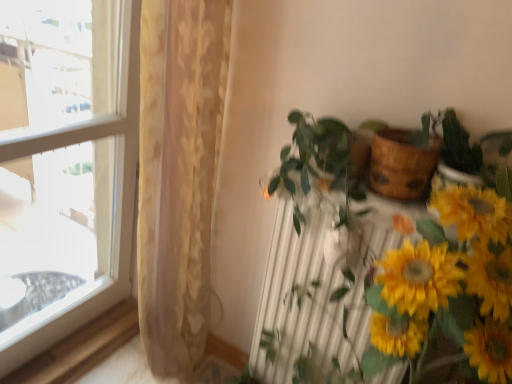
Question: Can you confirm if wooden at upper right is taller than green glossy plant at center?

Choices:
 (A) yes
 (B) no

Answer: (B)

Question: Is wooden at upper right oriented towards green glossy plant at center?

Choices:
 (A) no
 (B) yes

Answer: (A)

Question: Does wooden at upper right touch green glossy plant at center?

Choices:
 (A) yes
 (B) no

Answer: (B)

Question: Is the depth of wooden at upper right less than that of green glossy plant at center?

Choices:
 (A) yes
 (B) no

Answer: (B)

Question: Is wooden at upper right to the right of green glossy plant at center from the viewer's perspective?

Choices:
 (A) no
 (B) yes

Answer: (B)

Question: Looking at the image, does wooden at upper right seem bigger or smaller compared to green glossy plant at center?

Choices:
 (A) small
 (B) big

Answer: (A)

Question: Choose the correct answer: Is wooden at upper right inside green glossy plant at center or outside it?

Choices:
 (A) inside
 (B) outside

Answer: (B)

Question: From a real-world perspective, is wooden at upper right positioned above or below green glossy plant at center?

Choices:
 (A) below
 (B) above

Answer: (B)

Question: Considering the relative positions of wooden at upper right and green glossy plant at center in the image provided, is wooden at upper right to the left or to the right of green glossy plant at center?

Choices:
 (A) left
 (B) right

Answer: (B)

Question: Looking at their shapes, would you say transparent glass window at left is wider or thinner than green glossy plant at center?

Choices:
 (A) thin
 (B) wide

Answer: (A)

Question: In terms of height, does transparent glass window at left look taller or shorter compared to green glossy plant at center?

Choices:
 (A) short
 (B) tall

Answer: (B)

Question: In the image, is transparent glass window at left on the left side or the right side of green glossy plant at center?

Choices:
 (A) left
 (B) right

Answer: (A)

Question: Is transparent glass window at left bigger or smaller than green glossy plant at center?

Choices:
 (A) small
 (B) big

Answer: (B)

Question: Is transparent glass window at left wider or thinner than white metallic radiator at center?

Choices:
 (A) thin
 (B) wide

Answer: (A)

Question: Based on their sizes in the image, would you say transparent glass window at left is bigger or smaller than white metallic radiator at center?

Choices:
 (A) small
 (B) big

Answer: (B)